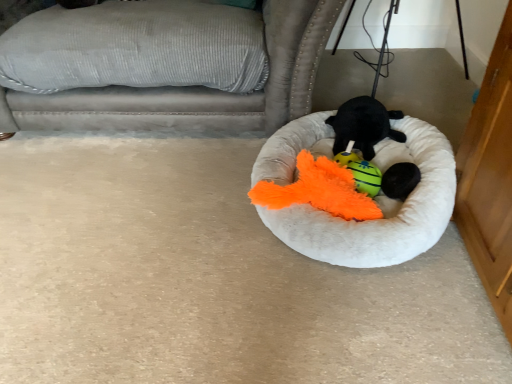
Question: Does point (412, 185) appear closer or farther from the camera than point (355, 170)?

Choices:
 (A) closer
 (B) farther

Answer: (A)

Question: Is black fuzzy ball at center spatially inside fluffy orange toy at center, acting as the first toy starting from the bottom, or outside of it?

Choices:
 (A) inside
 (B) outside

Answer: (B)

Question: Based on their relative distances, which object is farther from the soft plush toy at center, which appears as the second toy when ordered from the bottom?

Choices:
 (A) white fluffy dog bed at center
 (B) fluffy orange toy at center, the second toy in the top-to-bottom sequence
 (C) gray corduroy couch at upper left
 (D) black fuzzy ball at center

Answer: (C)

Question: Which of these objects is positioned farthest from the black fuzzy ball at center?

Choices:
 (A) fluffy orange toy at center, the second toy in the top-to-bottom sequence
 (B) soft plush toy at center, the 1th toy positioned from the top
 (C) white fluffy dog bed at center
 (D) gray corduroy couch at upper left

Answer: (D)